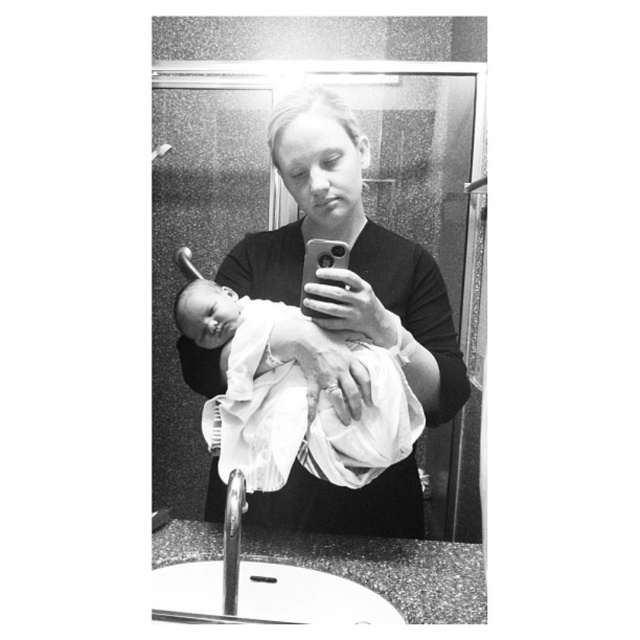
You are a photographer trying to capture a closeup of the baby in the bathroom scene. Since the soft white swaddle at center and the white clothed baby at center are both in the frame, which one should you focus on to ensure the baby is the main subject?

The white clothed baby at center is the main subject, so you should focus on the white clothed baby at center instead of the soft white swaddle at center.

You are a photographer trying to capture a closeup of the soft white swaddle at center. Given that your camera has a minimum focusing distance of 2 feet, will you be able to take the photo without moving closer?

The soft white swaddle at center is 3.33 feet away from the viewer. Since the minimum focusing distance is 2 feet, the photographer can take the photo without needing to move closer because the distance is within the camera capabilities.

You are a photographer trying to capture a closeup of the baby in the bathroom scene. Given that the soft white swaddle at center is larger than the white clothed baby at center, will the swaddle completely cover the baby in the photo?

The soft white swaddle at center is larger than the white clothed baby at center, so yes, the swaddle will completely cover the baby in the photo.